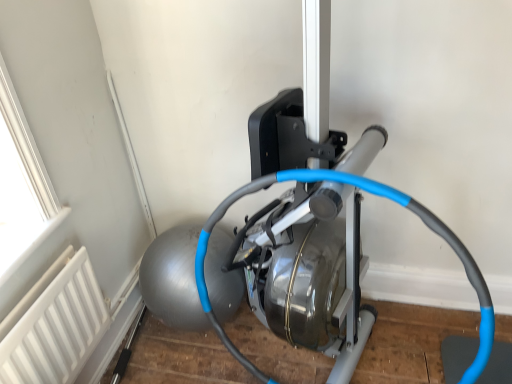
Question: Should I look upward or downward to see white matte radiator at lower left?

Choices:
 (A) up
 (B) down

Answer: (B)

Question: From the image's perspective, is white matte radiator at lower left under blue rubber hose at center?

Choices:
 (A) yes
 (B) no

Answer: (A)

Question: Could blue rubber hose at center be considered to be inside white matte radiator at lower left?

Choices:
 (A) no
 (B) yes

Answer: (A)

Question: Is white matte radiator at lower left positioned before blue rubber hose at center?

Choices:
 (A) yes
 (B) no

Answer: (B)

Question: Does white matte radiator at lower left have a smaller size compared to blue rubber hose at center?

Choices:
 (A) no
 (B) yes

Answer: (B)

Question: Does white matte radiator at lower left have a larger size compared to blue rubber hose at center?

Choices:
 (A) no
 (B) yes

Answer: (A)

Question: Is white matte radiator at lower left in contact with blue rubber hose at center?

Choices:
 (A) yes
 (B) no

Answer: (B)

Question: From a real-world perspective, does blue rubber hose at center sit lower than white matte radiator at lower left?

Choices:
 (A) no
 (B) yes

Answer: (A)

Question: Considering the relative sizes of blue rubber hose at center and white matte radiator at lower left in the image provided, is blue rubber hose at center bigger than white matte radiator at lower left?

Choices:
 (A) no
 (B) yes

Answer: (B)

Question: Is blue rubber hose at center far from white matte radiator at lower left?

Choices:
 (A) yes
 (B) no

Answer: (B)

Question: Does blue rubber hose at center have a lesser height compared to white matte radiator at lower left?

Choices:
 (A) no
 (B) yes

Answer: (A)

Question: From the image's perspective, is blue rubber hose at center under white matte radiator at lower left?

Choices:
 (A) no
 (B) yes

Answer: (A)

Question: Does blue rubber hose at center have a smaller size compared to white matte radiator at lower left?

Choices:
 (A) no
 (B) yes

Answer: (A)

Question: Is white matte radiator at lower left wider or thinner than blue rubber hose at center?

Choices:
 (A) wide
 (B) thin

Answer: (B)